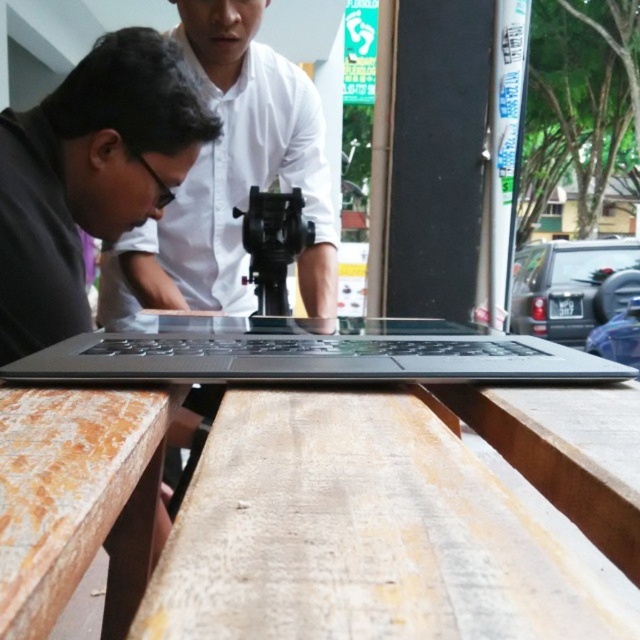
You are a photographer trying to capture a clear shot of both the matte black laptop at center and the sleek black laptop at center. Since the camera can only focus on one laptop at a time, which laptop should you focus on to ensure the other is still in the frame?

The matte black laptop at center is positioned on the left side of sleek black laptop at center. To ensure both are in the frame, focus on the laptop that is further to the left, which is the matte black laptop at center, as the sleek black laptop at center is to its right. This way, the camera can capture both in the shot by focusing on the leftmost laptop.

You are a delivery person who needs to place a package between the two laptops at the center of the table. The package is 40 centimeters long. Can you fit it between the matte black laptop at center and the sleek black laptop at center?

The distance between the matte black laptop at center and the sleek black laptop at center is 42.44 centimeters. Since the package is 40 centimeters long, it can fit between them with 2.44 centimeters of space remaining.

You are a photographer setting up a tripod to capture the scene. The wooden table at center and the matte black laptop at center are both in your view. According to the scene description, which object should you position your tripod to the left of to ensure both are framed properly?

You should position your tripod to the left of the wooden table at center because the wooden table at center is to the right of the matte black laptop at center, so placing the tripod to the left of the table ensures both objects are included in the frame.